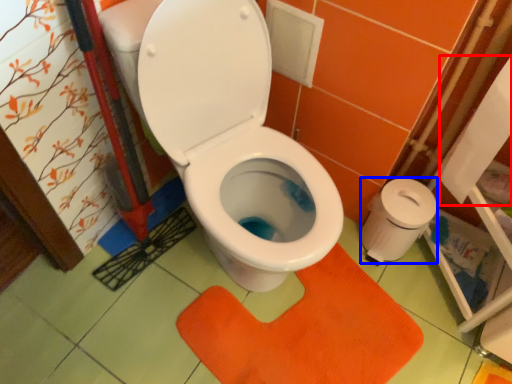
Question: Which object appears closest to the camera in this image, toilet paper (highlighted by a red box) or toilet paper (highlighted by a blue box)?

Choices:
 (A) toilet paper
 (B) toilet paper

Answer: (A)